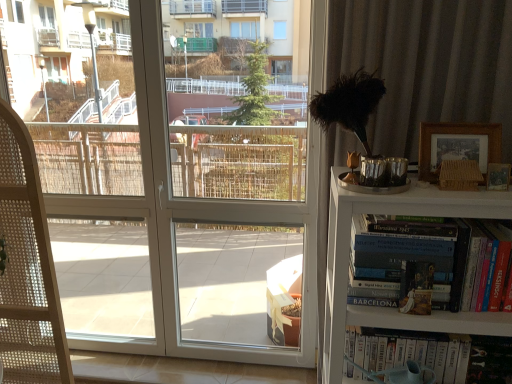
Image resolution: width=512 pixels, height=384 pixels. Describe the element at coordinates (383, 213) in the screenshot. I see `white wooden bookshelf at right` at that location.

Describe the element at coordinates (27, 267) in the screenshot. Image resolution: width=512 pixels, height=384 pixels. I see `woven wood folding chair at left` at that location.

Locate an element on the screen. This screenshot has height=384, width=512. woven wood folding chair at left is located at coordinates (27, 267).

Describe the element at coordinates (498, 177) in the screenshot. I see `wooden picture frame at upper right, which appears as the second picture frame when viewed from the top` at that location.

The width and height of the screenshot is (512, 384). What are the coordinates of `hardcover book at right` in the screenshot? It's located at (485, 267).

Image resolution: width=512 pixels, height=384 pixels. Describe the element at coordinates (181, 227) in the screenshot. I see `white glossy screen door at center` at that location.

Locate an element on the screen. wooden picture frame at upper right, the first picture frame positioned from the top is located at coordinates (457, 146).

Can you confirm if wooden picture frame at upper right, arranged as the first picture frame when ordered from the bottom, is positioned to the left of white wooden bookshelf at right?

Incorrect, wooden picture frame at upper right, arranged as the first picture frame when ordered from the bottom, is not on the left side of white wooden bookshelf at right.

Which object is more forward, wooden picture frame at upper right, arranged as the first picture frame when ordered from the bottom, or white wooden bookshelf at right?

white wooden bookshelf at right.

Does wooden picture frame at upper right, arranged as the first picture frame when ordered from the bottom, have a greater height compared to white wooden bookshelf at right?

No.

In order to click on the 1st picture frame behind when counting from the white wooden bookshelf at right in this screenshot , I will do `click(498, 177)`.

Considering the sizes of objects white glossy screen door at center and white glossy book at lower right, acting as the 1th book starting from the bottom, in the image provided, who is shorter, white glossy screen door at center or white glossy book at lower right, acting as the 1th book starting from the bottom,?

With less height is white glossy book at lower right, acting as the 1th book starting from the bottom.

Can you see white glossy screen door at center touching white glossy book at lower right, which is the second book in top-to-bottom order?

They are not placed beside each other.

Between white glossy screen door at center and white glossy book at lower right, acting as the 1th book starting from the bottom, which one has larger size?

white glossy screen door at center is bigger.

Is there a large distance between white wooden bookshelf at right and wooden picture frame at upper right, which is the 2th picture frame in bottom-to-top order?

white wooden bookshelf at right is near wooden picture frame at upper right, which is the 2th picture frame in bottom-to-top order, not far away.

Is white wooden bookshelf at right inside the boundaries of wooden picture frame at upper right, the first picture frame positioned from the top, or outside?

white wooden bookshelf at right is outside wooden picture frame at upper right, the first picture frame positioned from the top.

Considering the relative sizes of white wooden bookshelf at right and wooden picture frame at upper right, which is the 2th picture frame in bottom-to-top order, in the image provided, is white wooden bookshelf at right shorter than wooden picture frame at upper right, which is the 2th picture frame in bottom-to-top order,?

No, white wooden bookshelf at right is not shorter than wooden picture frame at upper right, which is the 2th picture frame in bottom-to-top order.

Does point (490, 145) appear closer or farther from the camera than point (492, 189)?

Clearly, point (490, 145) is more distant from the camera than point (492, 189).

Can you tell me how much wooden picture frame at upper right, which is the 2th picture frame in bottom-to-top order, and wooden picture frame at upper right, which appears as the second picture frame when viewed from the top, differ in facing direction?

The angular difference between wooden picture frame at upper right, which is the 2th picture frame in bottom-to-top order, and wooden picture frame at upper right, which appears as the second picture frame when viewed from the top, is 5.91 degrees.

Which object is closer to the camera taking this photo, wooden picture frame at upper right, which is the 2th picture frame in bottom-to-top order, or wooden picture frame at upper right, arranged as the first picture frame when ordered from the bottom?

Positioned in front is wooden picture frame at upper right, arranged as the first picture frame when ordered from the bottom.

In the scene shown: Is wooden picture frame at upper right, the first picture frame positioned from the top, positioned with its back to wooden picture frame at upper right, arranged as the first picture frame when ordered from the bottom?

No.

Is woven wood folding chair at left oriented towards wooden picture frame at upper right, the first picture frame positioned from the top?

No.

What's the angular difference between woven wood folding chair at left and wooden picture frame at upper right, the first picture frame positioned from the top,'s facing directions?

The facing directions of woven wood folding chair at left and wooden picture frame at upper right, the first picture frame positioned from the top, are 1.73 degrees apart.

Considering the sizes of woven wood folding chair at left and wooden picture frame at upper right, the first picture frame positioned from the top, in the image, is woven wood folding chair at left bigger or smaller than wooden picture frame at upper right, the first picture frame positioned from the top,?

In the image, woven wood folding chair at left appears to be larger than wooden picture frame at upper right, the first picture frame positioned from the top.

Is point (29, 187) more distant than point (500, 151)?

Yes, it is behind point (500, 151).

From the image's perspective, is woven wood folding chair at left positioned above or below wooden picture frame at upper right, arranged as the first picture frame when ordered from the bottom?

From the image's perspective, woven wood folding chair at left appears below wooden picture frame at upper right, arranged as the first picture frame when ordered from the bottom.

Looking at the image, does woven wood folding chair at left seem bigger or smaller compared to wooden picture frame at upper right, which appears as the second picture frame when viewed from the top?

Considering their sizes, woven wood folding chair at left takes up more space than wooden picture frame at upper right, which appears as the second picture frame when viewed from the top.

Does woven wood folding chair at left lie in front of wooden picture frame at upper right, which appears as the second picture frame when viewed from the top?

No, the depth of woven wood folding chair at left is greater than that of wooden picture frame at upper right, which appears as the second picture frame when viewed from the top.

Is woven wood folding chair at left outside of wooden picture frame at upper right, which appears as the second picture frame when viewed from the top?

Absolutely, woven wood folding chair at left is external to wooden picture frame at upper right, which appears as the second picture frame when viewed from the top.

Where is `bookcase lying in front of the white glossy screen door at center`? bookcase lying in front of the white glossy screen door at center is located at coordinates (383, 213).

Between point (306, 227) and point (331, 179), which one is positioned in front?

The point (331, 179) is in front.

From a real-world perspective, is white glossy screen door at center under white wooden bookshelf at right?

No, from a real-world perspective, white glossy screen door at center is not below white wooden bookshelf at right.

Is white glossy screen door at center situated inside white wooden bookshelf at right or outside?

white glossy screen door at center is spatially situated outside white wooden bookshelf at right.

From the image's perspective, starting from the white wooden bookshelf at right, which picture frame is the 1st one above? Please provide its 2D coordinates.

[(498, 177)]

Where is `screen door behind the white glossy book at lower right, which is the second book in top-to-bottom order`? The height and width of the screenshot is (384, 512). screen door behind the white glossy book at lower right, which is the second book in top-to-bottom order is located at coordinates (181, 227).

From the image, which object appears to be farther from white glossy book at lower right, acting as the 1th book starting from the bottom, white wooden bookshelf at right or woven wood folding chair at left?

woven wood folding chair at left.

Which object lies further to the anchor point woven wood folding chair at left, white wooden bookshelf at right or hardcover book at right, marked as the 2th book in a bottom-to-top arrangement?

hardcover book at right, marked as the 2th book in a bottom-to-top arrangement, lies further to woven wood folding chair at left than the other object.

From the image, which object appears to be nearer to wooden picture frame at upper right, arranged as the first picture frame when ordered from the bottom, white glossy screen door at center or woven wood folding chair at left?

Among the two, white glossy screen door at center is located nearer to wooden picture frame at upper right, arranged as the first picture frame when ordered from the bottom.

Considering their positions, is wooden picture frame at upper right, the first picture frame positioned from the top, positioned closer to woven wood folding chair at left than white glossy screen door at center?

white glossy screen door at center is positioned closer to the anchor woven wood folding chair at left.

Consider the image. Looking at the image, which one is located closer to white glossy screen door at center, white glossy book at lower right, which is the second book in top-to-bottom order, or wooden picture frame at upper right, the first picture frame positioned from the top?

The object closer to white glossy screen door at center is white glossy book at lower right, which is the second book in top-to-bottom order.

Looking at the image, which one is located further to woven wood folding chair at left, white glossy book at lower right, acting as the 1th book starting from the bottom, or white glossy screen door at center?

The object further to woven wood folding chair at left is white glossy book at lower right, acting as the 1th book starting from the bottom.

From the image, which object appears to be farther from wooden picture frame at upper right, which is the 2th picture frame in bottom-to-top order, hardcover book at right or white wooden bookshelf at right?

hardcover book at right is further to wooden picture frame at upper right, which is the 2th picture frame in bottom-to-top order.

When comparing their distances from wooden picture frame at upper right, the first picture frame positioned from the top, does white wooden bookshelf at right or woven wood folding chair at left seem further?

Among the two, woven wood folding chair at left is located further to wooden picture frame at upper right, the first picture frame positioned from the top.

Locate an element on the screen. The image size is (512, 384). book between wooden picture frame at upper right, the first picture frame positioned from the top, and white wooden bookshelf at right in the up-down direction is located at coordinates (413, 260).

Find the location of a particular element. The height and width of the screenshot is (384, 512). bookcase between woven wood folding chair at left and wooden picture frame at upper right, arranged as the first picture frame when ordered from the bottom, in the horizontal direction is located at coordinates (383, 213).

I want to click on book between white glossy screen door at center and white glossy book at lower right, which is the second book in top-to-bottom order, in the horizontal direction, so click(413, 260).

The width and height of the screenshot is (512, 384). In order to click on bookcase between woven wood folding chair at left and hardcover book at right from left to right in this screenshot , I will do `click(383, 213)`.